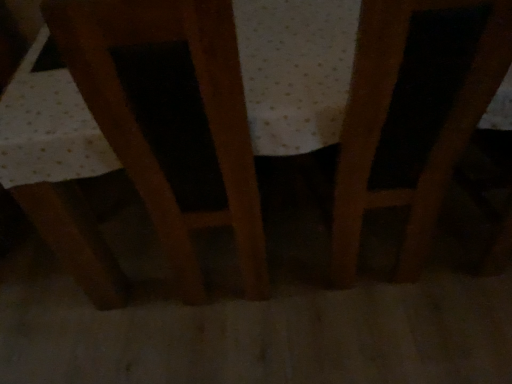
Where is `wooden swivel chair at center`? The image size is (512, 384). wooden swivel chair at center is located at coordinates (140, 129).

Measure the distance between point (x=245, y=210) and camera.

Result: Point (x=245, y=210) and camera are 1.16 meters apart from each other.

The width and height of the screenshot is (512, 384). What do you see at coordinates (140, 129) in the screenshot?
I see `wooden swivel chair at center` at bounding box center [140, 129].

Image resolution: width=512 pixels, height=384 pixels. Identify the location of wooden swivel chair at center. (140, 129).